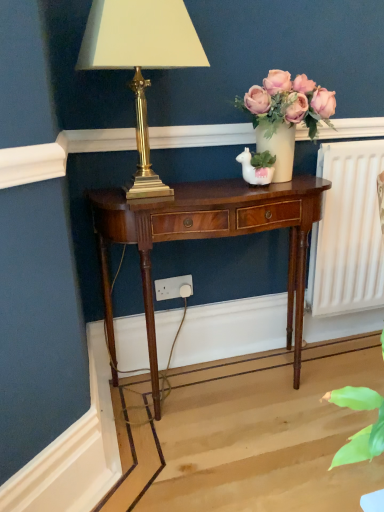
Question: Does white plastic power outlet at lower center have a greater height compared to gold brass lamp at upper left?

Choices:
 (A) yes
 (B) no

Answer: (B)

Question: Considering the relative sizes of white plastic power outlet at lower center and gold brass lamp at upper left in the image provided, is white plastic power outlet at lower center smaller than gold brass lamp at upper left?

Choices:
 (A) no
 (B) yes

Answer: (B)

Question: Is white plastic power outlet at lower center wider than gold brass lamp at upper left?

Choices:
 (A) no
 (B) yes

Answer: (A)

Question: Considering the relative sizes of white plastic power outlet at lower center and gold brass lamp at upper left in the image provided, is white plastic power outlet at lower center bigger than gold brass lamp at upper left?

Choices:
 (A) no
 (B) yes

Answer: (A)

Question: From a real-world perspective, is white plastic power outlet at lower center on gold brass lamp at upper left?

Choices:
 (A) yes
 (B) no

Answer: (B)

Question: In the image, is white plastic power outlet at lower center positioned in front of or behind mahogany wood nightstand at center?

Choices:
 (A) front
 (B) behind

Answer: (B)

Question: In terms of height, does white plastic power outlet at lower center look taller or shorter compared to mahogany wood nightstand at center?

Choices:
 (A) short
 (B) tall

Answer: (A)

Question: Is point (165, 279) positioned closer to the camera than point (139, 252)?

Choices:
 (A) closer
 (B) farther

Answer: (B)

Question: Considering the positions of white plastic power outlet at lower center and mahogany wood nightstand at center in the image, is white plastic power outlet at lower center bigger or smaller than mahogany wood nightstand at center?

Choices:
 (A) big
 (B) small

Answer: (B)

Question: Is gold brass lamp at upper left spatially inside matte white vase at upper right, or outside of it?

Choices:
 (A) outside
 (B) inside

Answer: (A)

Question: From a real-world perspective, is gold brass lamp at upper left physically located above or below matte white vase at upper right?

Choices:
 (A) above
 (B) below

Answer: (A)

Question: Does point (89, 55) appear closer or farther from the camera than point (281, 94)?

Choices:
 (A) closer
 (B) farther

Answer: (A)

Question: Considering the positions of gold brass lamp at upper left and matte white vase at upper right in the image, is gold brass lamp at upper left wider or thinner than matte white vase at upper right?

Choices:
 (A) wide
 (B) thin

Answer: (A)

Question: Visually, is gold brass lamp at upper left positioned to the left or to the right of mahogany wood nightstand at center?

Choices:
 (A) left
 (B) right

Answer: (A)

Question: Do you think gold brass lamp at upper left is within mahogany wood nightstand at center, or outside of it?

Choices:
 (A) inside
 (B) outside

Answer: (B)